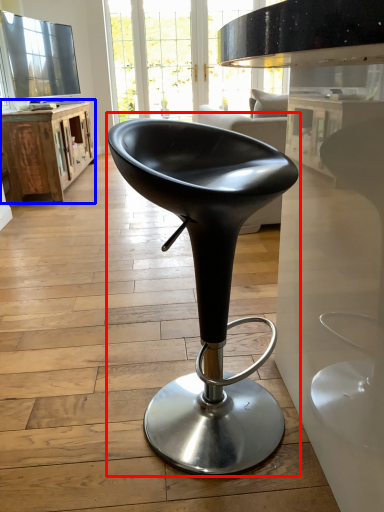
Question: Among these objects, which one is nearest to the camera, chair (highlighted by a red box) or table (highlighted by a blue box)?

Choices:
 (A) chair
 (B) table

Answer: (A)